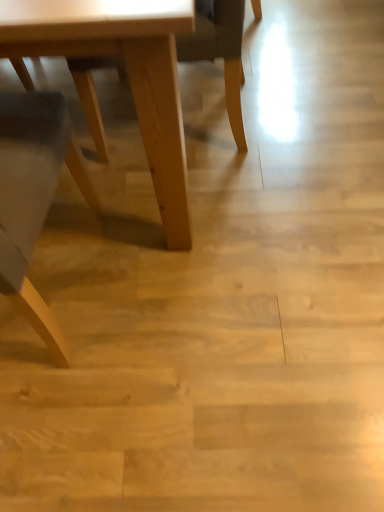
Question: Considering the positions of point (195, 54) and point (155, 134), is point (195, 54) closer or farther from the camera than point (155, 134)?

Choices:
 (A) closer
 (B) farther

Answer: (B)

Question: Would you say light brown wood chair at center is to the left or to the right of light wood table at lower left in the picture?

Choices:
 (A) left
 (B) right

Answer: (B)

Question: Is light brown wood chair at center taller or shorter than light wood table at lower left?

Choices:
 (A) tall
 (B) short

Answer: (B)

Question: In terms of height, does light wood table at lower left look taller or shorter compared to light brown wood chair at center?

Choices:
 (A) short
 (B) tall

Answer: (B)

Question: Considering the positions of light wood table at lower left and light brown wood chair at center in the image, is light wood table at lower left wider or thinner than light brown wood chair at center?

Choices:
 (A) wide
 (B) thin

Answer: (A)

Question: Is light wood table at lower left inside the boundaries of light brown wood chair at center, or outside?

Choices:
 (A) inside
 (B) outside

Answer: (B)

Question: In the image, is light wood table at lower left positioned in front of or behind light brown wood chair at center?

Choices:
 (A) front
 (B) behind

Answer: (A)